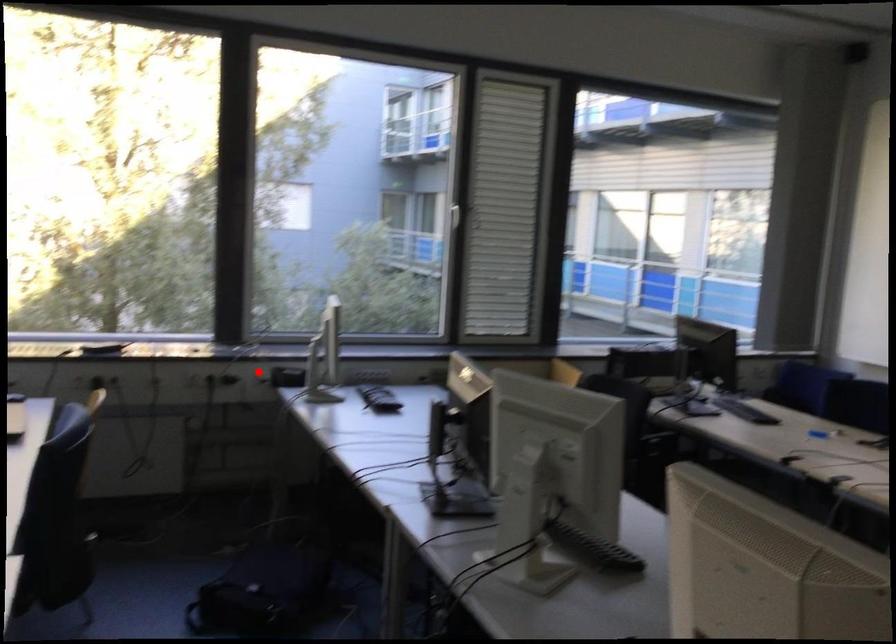
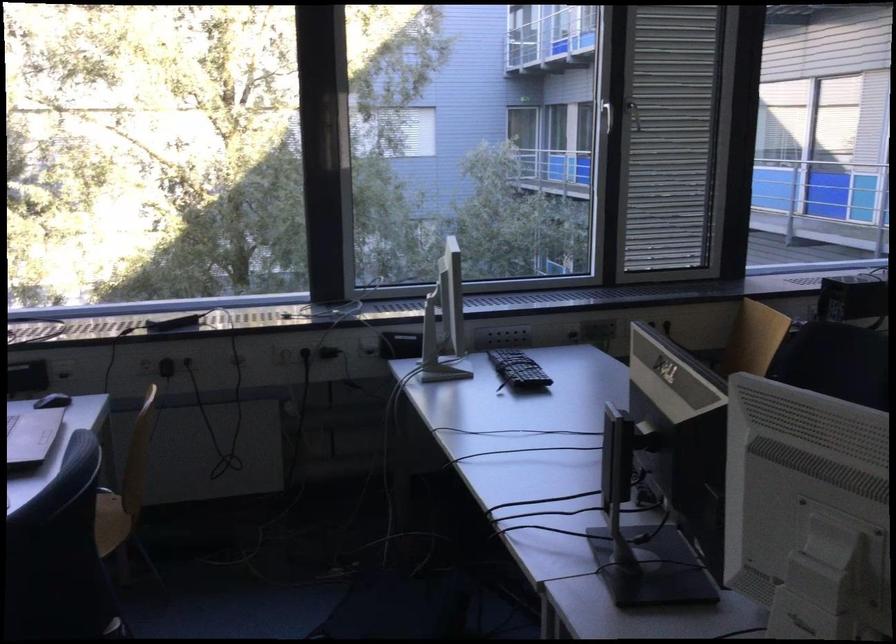
Find the pixel in the second image that matches the highlighted location in the first image.

(367, 348)